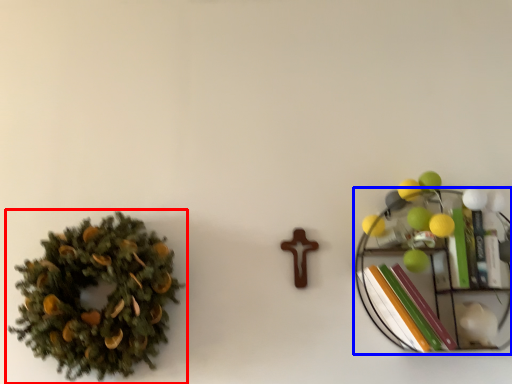
Question: Which object appears closest to the camera in this image, houseplant (highlighted by a red box) or shelf (highlighted by a blue box)?

Choices:
 (A) houseplant
 (B) shelf

Answer: (A)